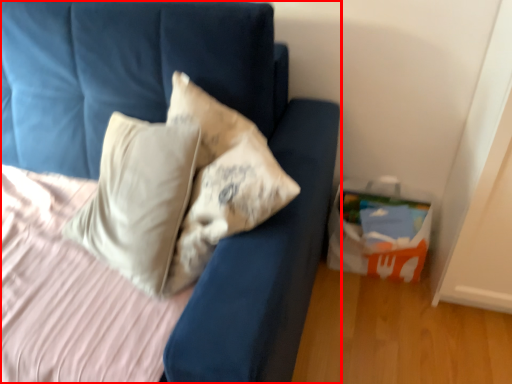
Question: Where is furniture (annotated by the red box) located in relation to package in the image?

Choices:
 (A) left
 (B) right

Answer: (A)